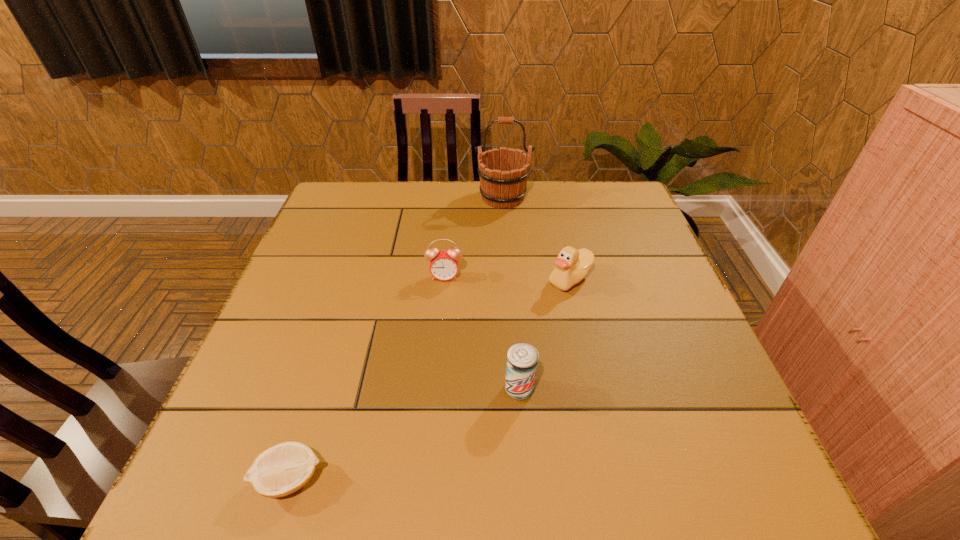
Locate an element on the screen. The height and width of the screenshot is (540, 960). vacant area that lies between the tallest object and the rightmost object is located at coordinates (537, 238).

Identify the location of free space between the wine bucket and the alarm clock. This screenshot has height=540, width=960. (474, 237).

You are a GUI agent. You are given a task and a screenshot of the screen. Output one action in this format:
    pyautogui.click(x=<x>, y=<y>)
    Task: Click on the vacant area that lies between the shortest object and the duck
    
    Given the screenshot: What is the action you would take?
    pyautogui.click(x=430, y=380)

Where is `empty space between the wine bucket and the alarm clock`? Image resolution: width=960 pixels, height=540 pixels. empty space between the wine bucket and the alarm clock is located at coordinates (474, 237).

Where is `vacant space that is in between the second object from left to right and the leftmost object`? Image resolution: width=960 pixels, height=540 pixels. vacant space that is in between the second object from left to right and the leftmost object is located at coordinates (368, 378).

The image size is (960, 540). What are the coordinates of `the fourth closest object relative to the second nearest object` in the screenshot? It's located at (503, 173).

Identify which object is the fourth closest to the duck. Please provide its 2D coordinates. Your answer should be formatted as a tuple, i.e. [(x, y)], where the tuple contains the x and y coordinates of a point satisfying the conditions above.

[(281, 470)]

Identify the location of vacant space that satisfies the following two spatial constraints: 1. at the beak of the duck; 2. on the front side of the second nearest object. (595, 389).

Find the location of a particular element. This screenshot has width=960, height=540. free space in the image that satisfies the following two spatial constraints: 1. at the beak of the duck; 2. on the front side of the shortest object is located at coordinates (615, 480).

The width and height of the screenshot is (960, 540). I want to click on vacant space that satisfies the following two spatial constraints: 1. on the back side of the wine bucket; 2. on the left side of the lemon, so click(379, 198).